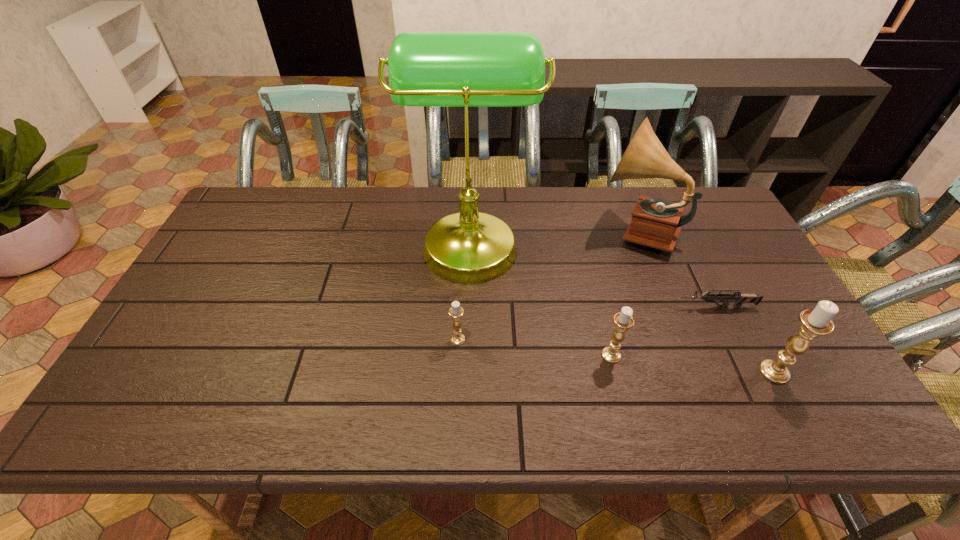
Given the evenly spaced candle holders in the image, where should an extra candle holder be added on the left to preserve the spacing? Please point to a vacant space. Please provide its 2D coordinates. Your answer should be formatted as a tuple, i.e. [(x, y)], where the tuple contains the x and y coordinates of a point satisfying the conditions above.

[(313, 325)]